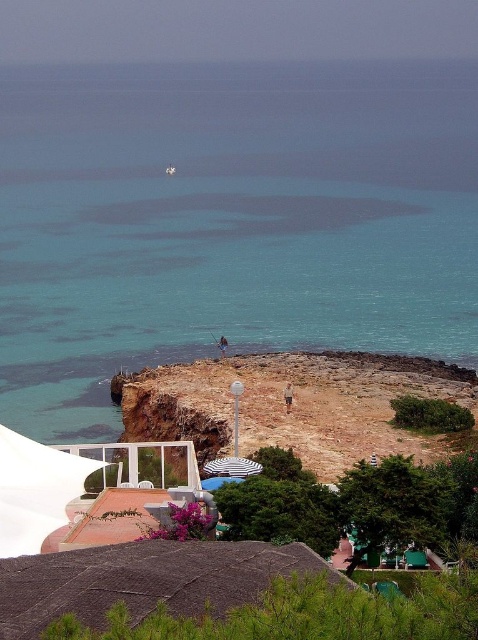
You are standing at the edge of the cliff and want to locate the clear blue water at center. According to the coordinates provided, in which direction should you look relative to your position?

The clear blue water at center is located at coordinates point (217,282). Since the coordinates are relative to the image, you should look towards the center of the image to find it.

You are a tourist visiting the coastal area and want to find the white striped umbrella at center. From your current position at the white sand beach at lower center, in which direction should you move to reach it?

The white sand beach at lower center is below the white striped umbrella at center, so you should move upward to reach the white striped umbrella at center.

What is the location of the point with coordinates [217,282] in the coastal scene?

The point with coordinates [217,282] is located on clear blue water at center.